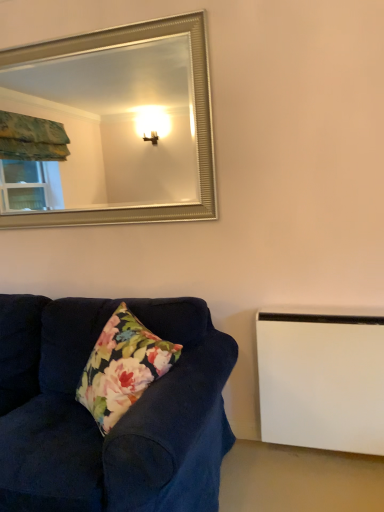
What do you see at coordinates (114, 123) in the screenshot?
I see `silver metallic mirror at upper center` at bounding box center [114, 123].

Where is `white matte radiator at lower right`? This screenshot has height=512, width=384. white matte radiator at lower right is located at coordinates (322, 377).

Considering their positions, is white matte radiator at lower right located in front of or behind silver metallic mirror at upper center?

Visually, white matte radiator at lower right is located in front of silver metallic mirror at upper center.

Does white matte radiator at lower right appear on the right side of silver metallic mirror at upper center?

Correct, you'll find white matte radiator at lower right to the right of silver metallic mirror at upper center.

Is white matte radiator at lower right smaller than silver metallic mirror at upper center?

Yes.

From the image's perspective, is white matte radiator at lower right above or below silver metallic mirror at upper center?

Clearly, from the image's perspective, white matte radiator at lower right is below silver metallic mirror at upper center.

Is white matte radiator at lower right placed right next to velvet dark blue couch at lower left?

No, white matte radiator at lower right is not in contact with velvet dark blue couch at lower left.

Based on the photo, who is bigger, white matte radiator at lower right or velvet dark blue couch at lower left?

velvet dark blue couch at lower left is bigger.

Between white matte radiator at lower right and velvet dark blue couch at lower left, which one has smaller width?

Thinner between the two is white matte radiator at lower right.

In the image, there is a white matte radiator at lower right. At what (x,y) coordinates should I click in order to perform the action: click on studio couch below it (from the image's perspective). Please return your answer as a coordinate pair (x, y). Looking at the image, I should click on (120, 420).

Is silver metallic mirror at upper center not inside velvet dark blue couch at lower left?

Yes, silver metallic mirror at upper center is located beyond the bounds of velvet dark blue couch at lower left.

Between silver metallic mirror at upper center and velvet dark blue couch at lower left, which one has larger width?

velvet dark blue couch at lower left is wider.

Is silver metallic mirror at upper center oriented away from velvet dark blue couch at lower left?

No, silver metallic mirror at upper center is not facing away from velvet dark blue couch at lower left.

Is silver metallic mirror at upper center directly adjacent to velvet dark blue couch at lower left?

silver metallic mirror at upper center is not next to velvet dark blue couch at lower left, and they're not touching.

Which of these two, velvet dark blue couch at lower left or silver metallic mirror at upper center, stands shorter?

Standing shorter between the two is velvet dark blue couch at lower left.

How much distance is there between velvet dark blue couch at lower left and silver metallic mirror at upper center?

velvet dark blue couch at lower left is 3.07 meters away from silver metallic mirror at upper center.

Considering the sizes of objects velvet dark blue couch at lower left and silver metallic mirror at upper center in the image provided, who is bigger, velvet dark blue couch at lower left or silver metallic mirror at upper center?

velvet dark blue couch at lower left is bigger.

Is point (151, 430) farther from camera compared to point (184, 97)?

No.

Is silver metallic mirror at upper center completely or partially outside of white matte radiator at lower right?

Indeed, silver metallic mirror at upper center is completely outside white matte radiator at lower right.

Between silver metallic mirror at upper center and white matte radiator at lower right, which one has more height?

silver metallic mirror at upper center.

From a real-world perspective, is silver metallic mirror at upper center positioned over white matte radiator at lower right based on gravity?

Correct, in the physical world, silver metallic mirror at upper center is higher than white matte radiator at lower right.

Looking at this image, could you tell me if silver metallic mirror at upper center is turned towards white matte radiator at lower right?

No, silver metallic mirror at upper center is not facing towards white matte radiator at lower right.

From the image's perspective, is velvet dark blue couch at lower left above or below white matte radiator at lower right?

velvet dark blue couch at lower left is below white matte radiator at lower right.

Can you tell me how much velvet dark blue couch at lower left and white matte radiator at lower right differ in facing direction?

2.31 degrees separate the facing orientations of velvet dark blue couch at lower left and white matte radiator at lower right.

Can you confirm if velvet dark blue couch at lower left is taller than white matte radiator at lower right?

Indeed, velvet dark blue couch at lower left has a greater height compared to white matte radiator at lower right.

In the image, is velvet dark blue couch at lower left on the left side or the right side of white matte radiator at lower right?

velvet dark blue couch at lower left is positioned on white matte radiator at lower right's left side.

You are a GUI agent. You are given a task and a screenshot of the screen. Output one action in this format:
    pyautogui.click(x=<x>, y=<y>)
    Task: Click on the mirror that is above the white matte radiator at lower right (from the image's perspective)
    This screenshot has height=512, width=384.
    Given the screenshot: What is the action you would take?
    pyautogui.click(x=114, y=123)

Where is `radiator located behind the velvet dark blue couch at lower left`? radiator located behind the velvet dark blue couch at lower left is located at coordinates (322, 377).

Considering their positions, is velvet dark blue couch at lower left positioned further to white matte radiator at lower right than silver metallic mirror at upper center?

silver metallic mirror at upper center is positioned further to the anchor white matte radiator at lower right.

Which object lies further to the anchor point silver metallic mirror at upper center, velvet dark blue couch at lower left or white matte radiator at lower right?

white matte radiator at lower right is positioned further to the anchor silver metallic mirror at upper center.

Which object lies nearer to the anchor point velvet dark blue couch at lower left, white matte radiator at lower right or silver metallic mirror at upper center?

white matte radiator at lower right is positioned closer to the anchor velvet dark blue couch at lower left.

Considering their positions, is white matte radiator at lower right positioned closer to silver metallic mirror at upper center than velvet dark blue couch at lower left?

velvet dark blue couch at lower left lies closer to silver metallic mirror at upper center than the other object.

Based on their spatial positions, is silver metallic mirror at upper center or velvet dark blue couch at lower left closer to white matte radiator at lower right?

velvet dark blue couch at lower left is positioned closer to the anchor white matte radiator at lower right.

Considering their positions, is silver metallic mirror at upper center positioned closer to velvet dark blue couch at lower left than white matte radiator at lower right?

The object closer to velvet dark blue couch at lower left is white matte radiator at lower right.

Image resolution: width=384 pixels, height=512 pixels. What are the coordinates of `radiator that lies between silver metallic mirror at upper center and velvet dark blue couch at lower left from top to bottom` in the screenshot? It's located at (322, 377).